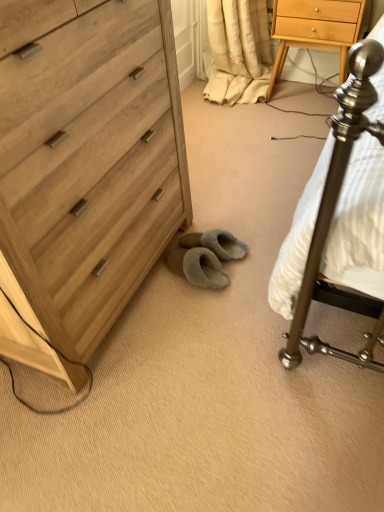
Question: Should I look upward or downward to see light wood chest of drawers at left?

Choices:
 (A) down
 (B) up

Answer: (B)

Question: Should I look upward or downward to see light wood/finish nightstand at upper right?

Choices:
 (A) down
 (B) up

Answer: (B)

Question: From the image's perspective, is light wood/finish nightstand at upper right below light wood chest of drawers at left?

Choices:
 (A) no
 (B) yes

Answer: (A)

Question: Is light wood chest of drawers at left inside light wood/finish nightstand at upper right?

Choices:
 (A) yes
 (B) no

Answer: (B)

Question: Is light wood/finish nightstand at upper right far from light wood chest of drawers at left?

Choices:
 (A) yes
 (B) no

Answer: (A)

Question: Is light wood/finish nightstand at upper right wider than light wood chest of drawers at left?

Choices:
 (A) no
 (B) yes

Answer: (A)

Question: Can you confirm if light wood/finish nightstand at upper right is bigger than light wood chest of drawers at left?

Choices:
 (A) no
 (B) yes

Answer: (A)

Question: Is light wood/finish nightstand at upper right smaller than light wood chest of drawers at left?

Choices:
 (A) no
 (B) yes

Answer: (B)

Question: Would you say light wood chest of drawers at left is outside light wood/finish nightstand at upper right?

Choices:
 (A) no
 (B) yes

Answer: (B)

Question: From a real-world perspective, is light wood chest of drawers at left physically above light wood/finish nightstand at upper right?

Choices:
 (A) yes
 (B) no

Answer: (A)

Question: Does light wood chest of drawers at left come in front of light wood/finish nightstand at upper right?

Choices:
 (A) no
 (B) yes

Answer: (B)

Question: Can you confirm if light wood chest of drawers at left is wider than light wood/finish nightstand at upper right?

Choices:
 (A) no
 (B) yes

Answer: (B)

Question: Is light wood chest of drawers at left far away from light wood/finish nightstand at upper right?

Choices:
 (A) yes
 (B) no

Answer: (A)

Question: Does light wood chest of drawers at left appear on the right side of light wood/finish nightstand at upper right?

Choices:
 (A) yes
 (B) no

Answer: (B)

Question: Is light wood/finish nightstand at upper right inside the boundaries of light wood chest of drawers at left, or outside?

Choices:
 (A) inside
 (B) outside

Answer: (B)